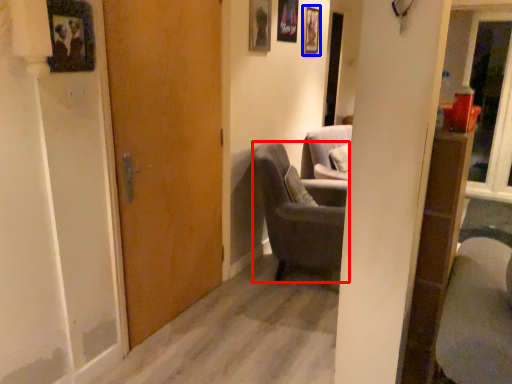
Question: Which point is further to the camera, chair (highlighted by a red box) or picture frame (highlighted by a blue box)?

Choices:
 (A) chair
 (B) picture frame

Answer: (B)